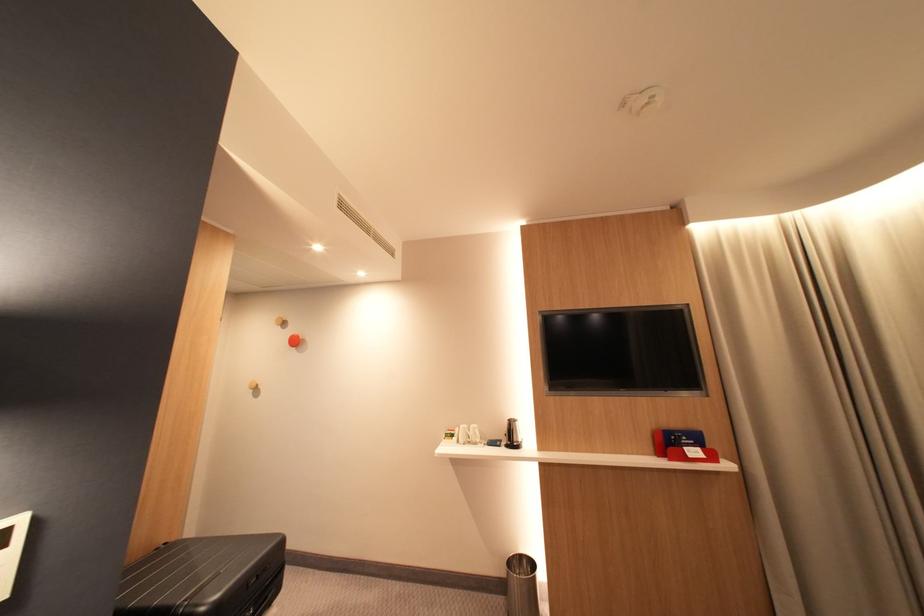
Find where to lift the red booklet holder. Please return your answer as a coordinate pair (x, y).

(691, 455)